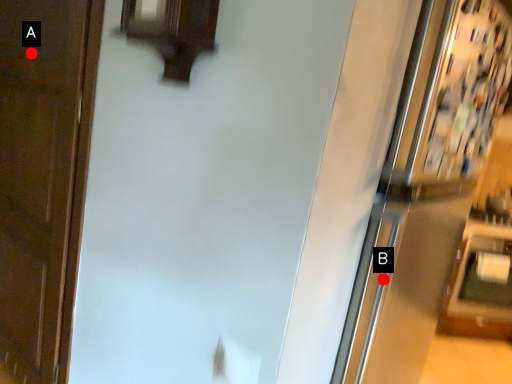
Question: Two points are circled on the image, labeled by A and B beside each circle. Which of the following is the closest to the observer?

Choices:
 (A) A is closer
 (B) B is closer

Answer: (B)